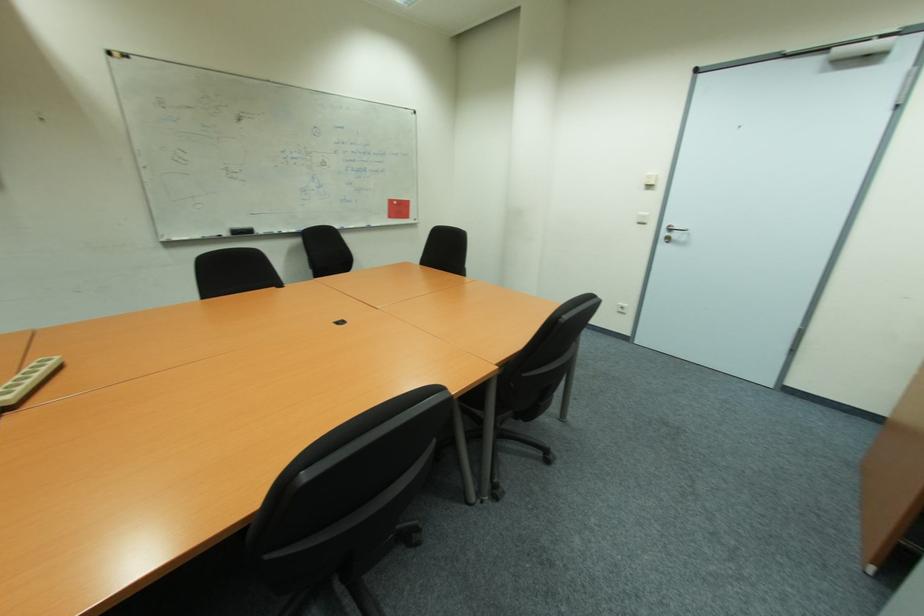
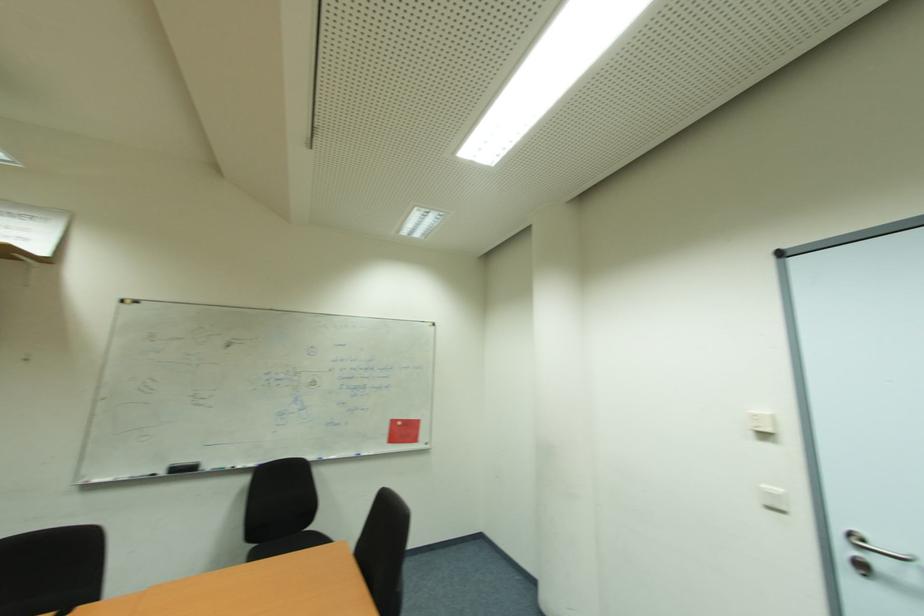
Find the pixel in the second image that matches (x=658, y=175) in the first image.

(771, 414)